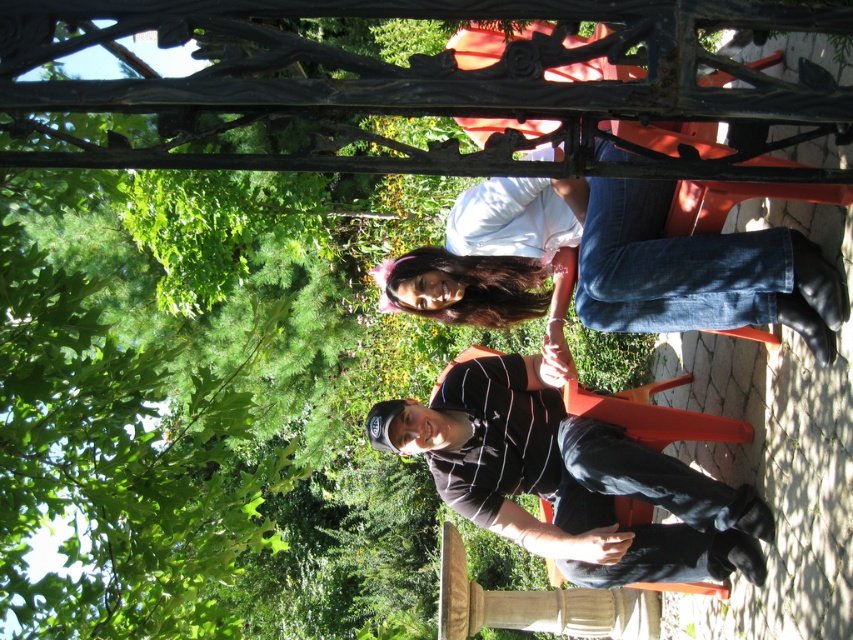
Question: Where is black striped shirt at center located in relation to denim jeans at center in the image?

Choices:
 (A) above
 (B) below

Answer: (B)

Question: Is black striped shirt at center bigger than denim jeans at center?

Choices:
 (A) yes
 (B) no

Answer: (A)

Question: Does black striped shirt at center have a smaller size compared to denim jeans at center?

Choices:
 (A) yes
 (B) no

Answer: (B)